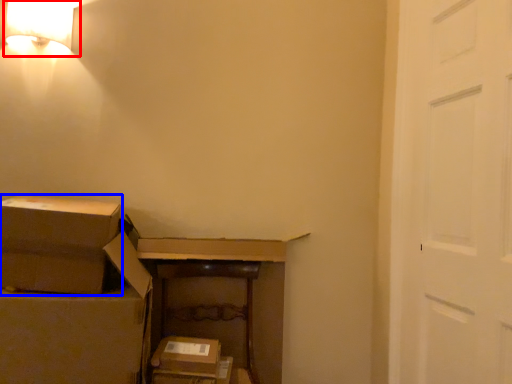
Question: Which point is further to the camera, lamp (highlighted by a red box) or box (highlighted by a blue box)?

Choices:
 (A) lamp
 (B) box

Answer: (A)